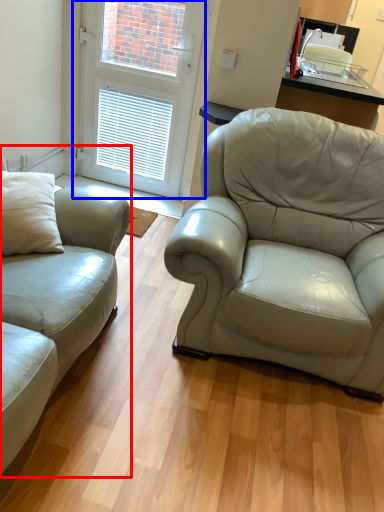
Question: Which of the following is the closest to the observer, studio couch (highlighted by a red box) or door (highlighted by a blue box)?

Choices:
 (A) studio couch
 (B) door

Answer: (A)